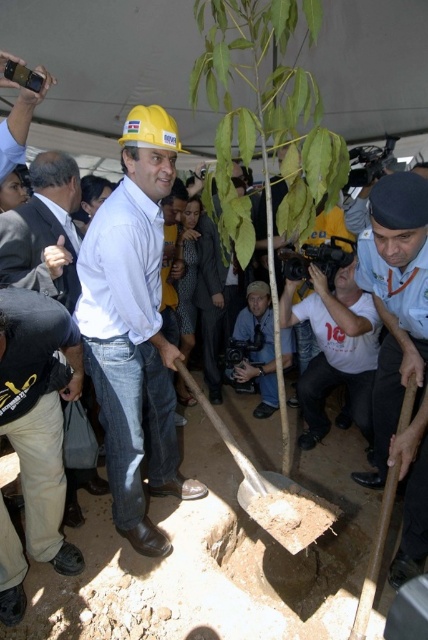
Based on the photo, you are standing at the point marked as point (x=145, y=392) during a tree planting event. You want to take a photo of the man in the yellow hard hat with the camera. Can you reach the camera from your current position without moving? Explain your reasoning.

The distance between point (x=145, y=392) and the camera is 2.98 meters. Since you are at point (x=145, y=392), you would need to move 2.98 meters to reach the camera. Therefore, you cannot reach the camera without moving.

Based on the photo, based on the scene description, which object is located below the other between the white matte shirt at center and the dark gray suit at center?

The white matte shirt at center is positioned under the dark gray suit at center, meaning it is located below the dark gray suit at center.

You are a photographer at the tree planting event. You need to take a photo of the brown wooden shovel at center without the matte black camera at lower center appearing in the frame. Is this possible based on their positions?

The brown wooden shovel at center is behind the matte black camera at lower center. Therefore, if you position yourself so that the camera is not in the foreground, you can capture the shovel without it being blocked or visible in the frame.